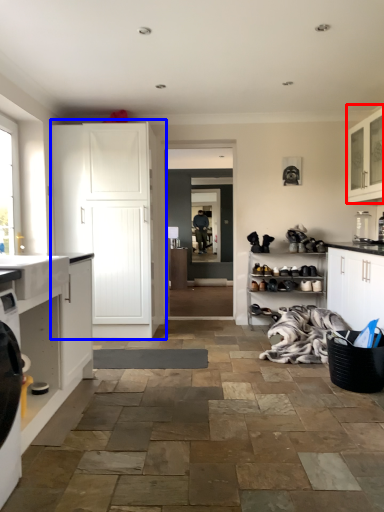
Question: Which object appears farthest to the camera in this image, cabinetry (highlighted by a red box) or cabinetry (highlighted by a blue box)?

Choices:
 (A) cabinetry
 (B) cabinetry

Answer: (B)